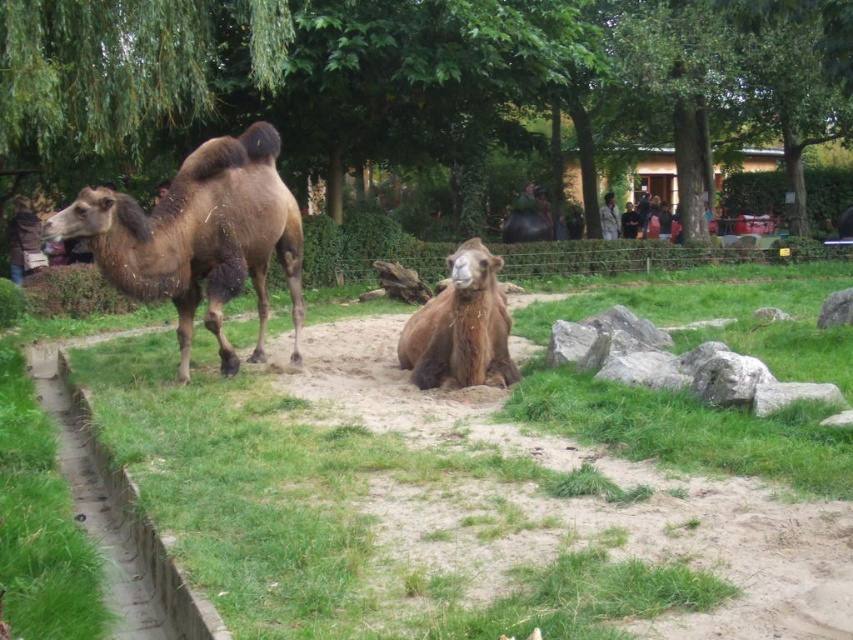
You are standing at the base of the green leafy tree at upper center and want to throw a ball to your friend who is 9.60 meters away. If your throwing range is 10 meters, can you reach them?

The distance between you and your friend is exactly 9.60 meters, which is within your 10 meter throwing range. Yes, you can reach them.

You are a zookeeper standing at the camera position. You need to feed the brown fuzzy camel at center. The feeding tool you have can reach up to 6 meters. Can you reach the camel with the tool?

The brown fuzzy camel at center is 6.68 meters from camera, which is beyond the 6 meters reach of the feeding tool. Therefore, you cannot reach the camel with the tool.

You are standing in the zoo looking at the two camels. There are two points marked in the image. One is at coordinate point(503, 337) and the other is at point(844, 316). Which point is closer to you?

Point(503, 337) is closer to the viewer than point(844, 316).